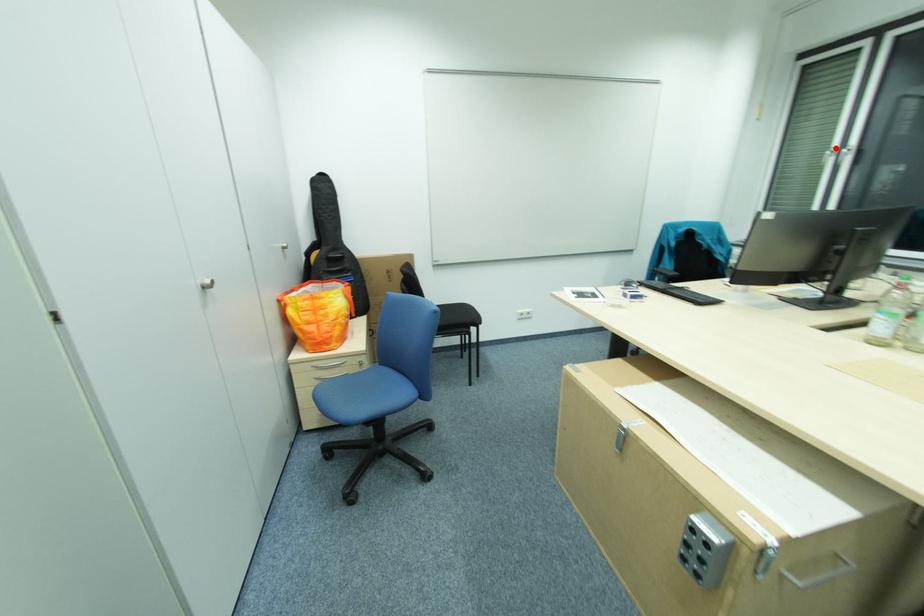
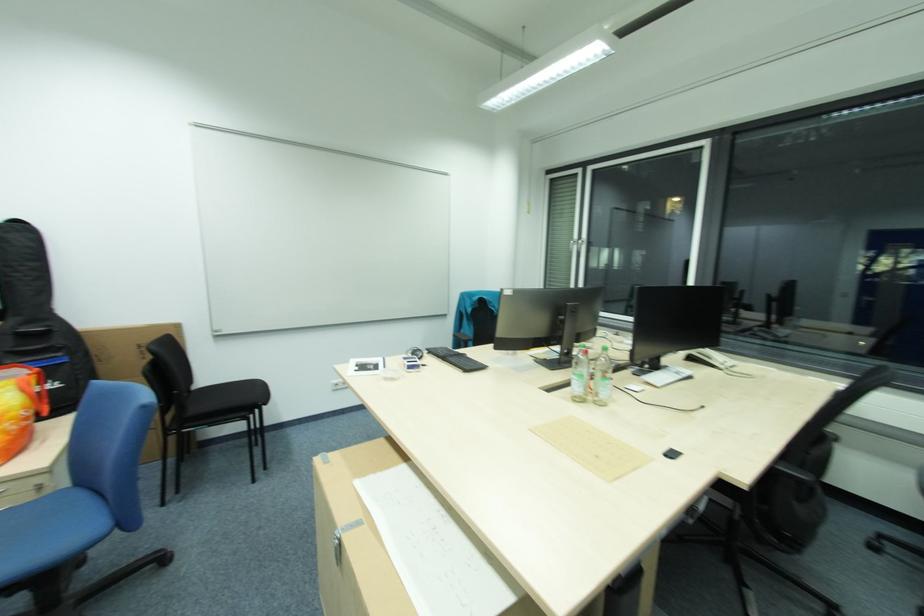
Question: I am providing you with two images of the same scene from different viewpoints. In image1, a red point is highlighted. Considering the same 3D point in image2, which of the following is correct?

Choices:
 (A) It is closer
 (B) It is farther

Answer: (A)